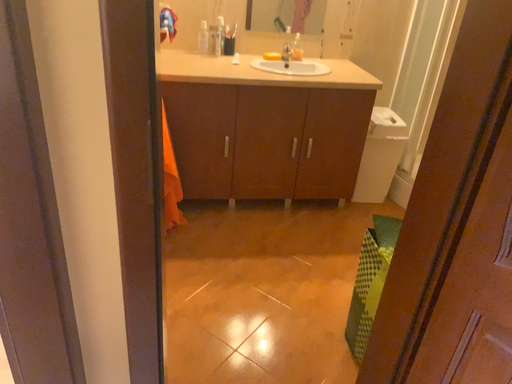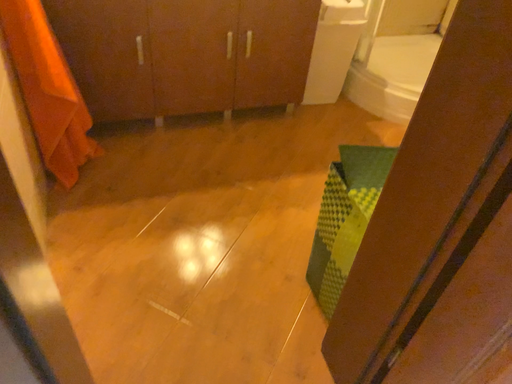
Question: Which way did the camera rotate in the video?

Choices:
 (A) rotated upward
 (B) rotated downward

Answer: (B)